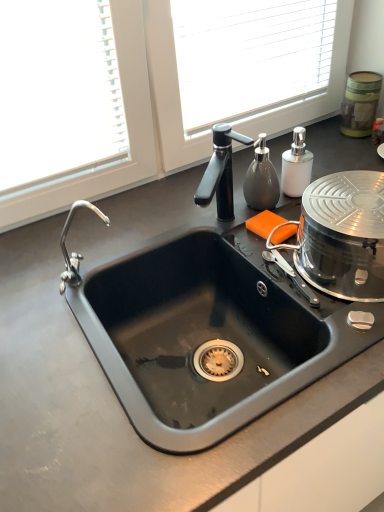
You are a GUI agent. You are given a task and a screenshot of the screen. Output one action in this format:
    pyautogui.click(x=<x>, y=<y>)
    Task: Click on the vacant area on top of shiny metallic steamer at right, which appears as the second appliance when viewed from the back (from a real-world perspective)
    The width and height of the screenshot is (384, 512).
    Given the screenshot: What is the action you would take?
    pyautogui.click(x=353, y=194)